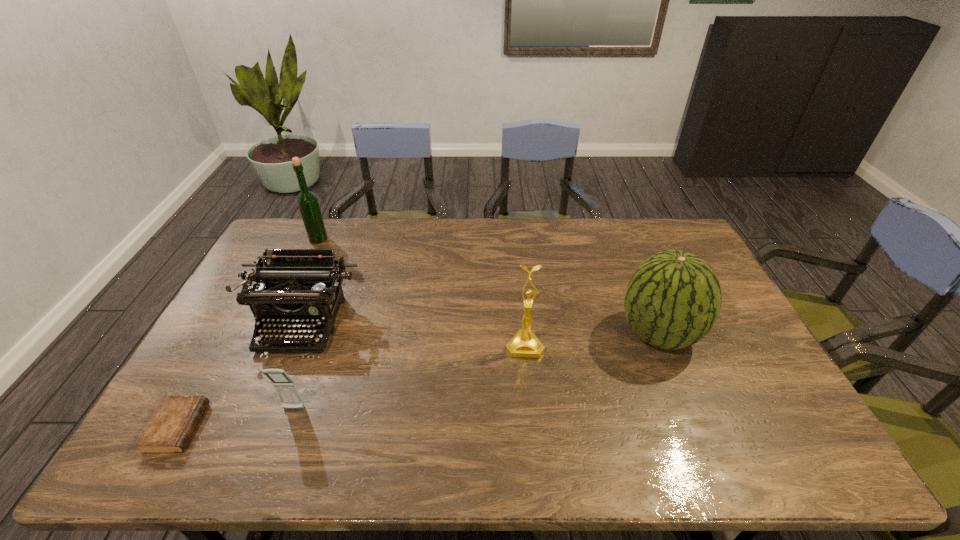
Where is `free area in between the fifth tallest object and the diary`? The image size is (960, 540). free area in between the fifth tallest object and the diary is located at coordinates (235, 418).

This screenshot has width=960, height=540. What are the coordinates of `free space between the fifth tallest object and the shortest object` in the screenshot? It's located at (235, 418).

Locate an element on the screen. This screenshot has height=540, width=960. vacant space in between the second shortest object and the award is located at coordinates (409, 377).

The width and height of the screenshot is (960, 540). Find the location of `object that is the fourth closest one to the watermelon`. object that is the fourth closest one to the watermelon is located at coordinates (307, 201).

The image size is (960, 540). I want to click on object that ranks as the third closest to the liquor, so click(286, 388).

This screenshot has width=960, height=540. Identify the location of vacant point that satisfies the following two spatial constraints: 1. on the front-facing side of the fifth tallest object; 2. on the spine side of the diary. (287, 428).

Locate an element on the screen. free spot that satisfies the following two spatial constraints: 1. on the front-facing side of the second object from right to left; 2. on the spine side of the diary is located at coordinates (533, 428).

Locate an element on the screen. Image resolution: width=960 pixels, height=540 pixels. free location that satisfies the following two spatial constraints: 1. on the front-facing side of the cellular telephone; 2. on the spine side of the shortest object is located at coordinates (287, 428).

Where is `free location that satisfies the following two spatial constraints: 1. on the keyboard of the watermelon; 2. on the right side of the typewriter`? This screenshot has height=540, width=960. free location that satisfies the following two spatial constraints: 1. on the keyboard of the watermelon; 2. on the right side of the typewriter is located at coordinates [298, 334].

The width and height of the screenshot is (960, 540). What are the coordinates of `vacant position in the image that satisfies the following two spatial constraints: 1. on the keyboard of the third shortest object; 2. on the right side of the rightmost object` in the screenshot? It's located at (298, 334).